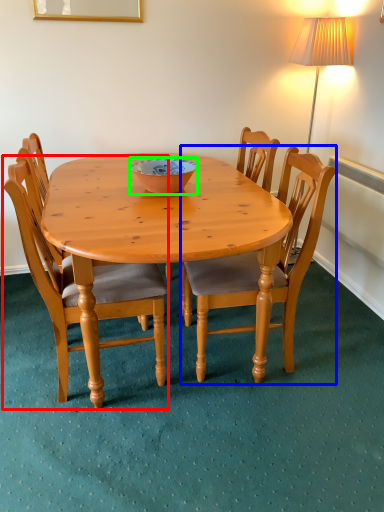
Question: Based on their relative distances, which object is farther from chair (highlighted by a red box)? Choose from chair (highlighted by a blue box) and bowl (highlighted by a green box).

Choices:
 (A) chair
 (B) bowl

Answer: (B)